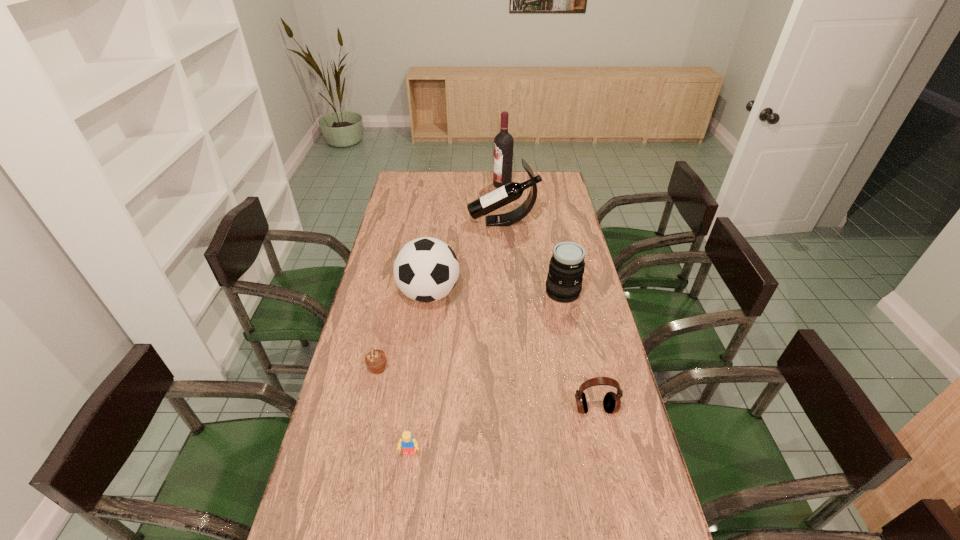
Where is `vacant region located on the front-facing side of the nearest object`? Image resolution: width=960 pixels, height=540 pixels. vacant region located on the front-facing side of the nearest object is located at coordinates [x=404, y=497].

In order to click on object at the far edge in this screenshot , I will do `click(503, 143)`.

The height and width of the screenshot is (540, 960). Identify the location of soccer ball at the left edge. pos(426,269).

Find the location of a particular element. Image resolution: width=960 pixels, height=540 pixels. muffin located in the left edge section of the desktop is located at coordinates (375, 360).

In order to click on wine bottle that is positioned at the right edge in this screenshot , I will do click(x=512, y=191).

Identify the location of telephoto lens situated at the right edge. This screenshot has height=540, width=960. (564, 280).

Image resolution: width=960 pixels, height=540 pixels. In order to click on headset located in the right edge section of the desktop in this screenshot , I will do `click(612, 402)`.

In the image, there is a desktop. Where is `vacant space at the far edge`? The height and width of the screenshot is (540, 960). vacant space at the far edge is located at coordinates (482, 188).

Where is `free space at the left edge of the desktop`? The width and height of the screenshot is (960, 540). free space at the left edge of the desktop is located at coordinates (399, 237).

Locate an element on the screen. The width and height of the screenshot is (960, 540). vacant space at the right edge is located at coordinates [x=594, y=320].